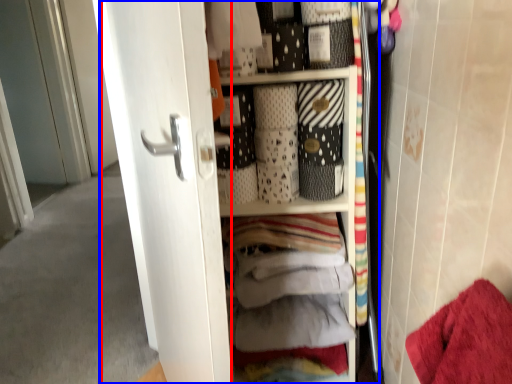
Question: Among these objects, which one is nearest to the camera, screen door (highlighted by a red box) or dresser (highlighted by a blue box)?

Choices:
 (A) screen door
 (B) dresser

Answer: (A)